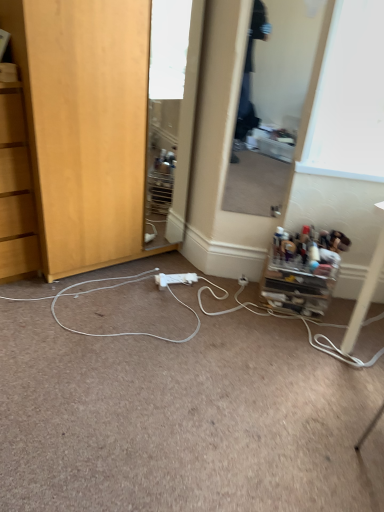
Question: Can you confirm if white plastic electric outlet at center is taller than wooden cabinet at lower left, arranged as the second cabinetry when ordered from the bottom?

Choices:
 (A) no
 (B) yes

Answer: (A)

Question: From the image's perspective, would you say white plastic electric outlet at center is shown under wooden cabinet at lower left, the 1th cabinetry in the left-to-right sequence?

Choices:
 (A) no
 (B) yes

Answer: (B)

Question: Is white plastic electric outlet at center facing towards wooden cabinet at lower left, placed as the 2th cabinetry when sorted from right to left?

Choices:
 (A) no
 (B) yes

Answer: (A)

Question: Is white plastic electric outlet at center turned away from wooden cabinet at lower left, placed as the 2th cabinetry when sorted from right to left?

Choices:
 (A) yes
 (B) no

Answer: (B)

Question: From a real-world perspective, is white plastic electric outlet at center below wooden cabinet at lower left, which appears as the first cabinetry when viewed from the top?

Choices:
 (A) yes
 (B) no

Answer: (A)

Question: Considering the positions of white plastic power strip at center and white plastic power outlet at center in the image, is white plastic power strip at center wider or thinner than white plastic power outlet at center?

Choices:
 (A) thin
 (B) wide

Answer: (B)

Question: From their relative heights in the image, would you say white plastic power strip at center is taller or shorter than white plastic power outlet at center?

Choices:
 (A) short
 (B) tall

Answer: (A)

Question: In the image, is white plastic power strip at center positioned in front of or behind white plastic power outlet at center?

Choices:
 (A) front
 (B) behind

Answer: (A)

Question: From the image's perspective, relative to white plastic power outlet at center, is white plastic power strip at center above or below?

Choices:
 (A) above
 (B) below

Answer: (B)

Question: Considering their positions, is wooden cabinet at lower left, arranged as the second cabinetry when ordered from the bottom, located in front of or behind white plastic power strip at center?

Choices:
 (A) front
 (B) behind

Answer: (B)

Question: In terms of size, does wooden cabinet at lower left, arranged as the second cabinetry when ordered from the bottom, appear bigger or smaller than white plastic power strip at center?

Choices:
 (A) small
 (B) big

Answer: (B)

Question: Is point (132, 143) positioned closer to the camera than point (205, 330)?

Choices:
 (A) farther
 (B) closer

Answer: (B)

Question: Is wooden cabinet at lower left, placed as the 2th cabinetry when sorted from right to left, situated inside white plastic power strip at center or outside?

Choices:
 (A) inside
 (B) outside

Answer: (B)

Question: In the image, is clear glass mirror at center, which is counted as the 2th mirror, starting from the right, on the left side or the right side of wooden cabinet at lower left, placed as the 2th cabinetry when sorted from right to left?

Choices:
 (A) right
 (B) left

Answer: (A)

Question: Relative to wooden cabinet at lower left, placed as the 2th cabinetry when sorted from right to left, is clear glass mirror at center, positioned as the 1th mirror in left-to-right order, in front or behind?

Choices:
 (A) front
 (B) behind

Answer: (B)